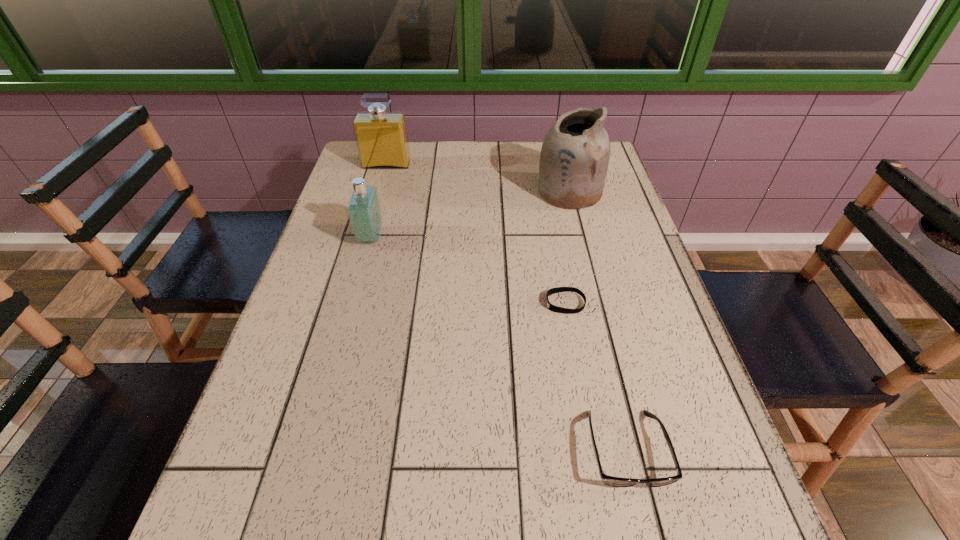
At what (x,y) coordinates should I click in order to perform the action: click on free space located on the front-facing side of the taller perfume. Please return your answer as a coordinate pair (x, y). The width and height of the screenshot is (960, 540). Looking at the image, I should click on (378, 193).

Identify the location of free location located on the front label of the third shortest object. This screenshot has height=540, width=960. tap(444, 237).

The image size is (960, 540). In order to click on vacant space located 0.060m on the display of the fourth farthest object in this screenshot , I will do `click(519, 303)`.

Locate an element on the screen. Image resolution: width=960 pixels, height=540 pixels. free region located 0.200m on the display of the fourth farthest object is located at coordinates (459, 303).

Locate an element on the screen. This screenshot has width=960, height=540. vacant space situated on the display of the fourth farthest object is located at coordinates (386, 303).

I want to click on pottery at the far edge, so click(x=574, y=158).

Find the location of a particular element. perfume located in the far edge section of the desktop is located at coordinates (381, 137).

Where is `pottery that is at the right edge`? pottery that is at the right edge is located at coordinates (574, 158).

At what (x,y) coordinates should I click in order to perform the action: click on spectacles at the right edge. Please return your answer as a coordinate pair (x, y). Looking at the image, I should click on (612, 481).

You are a GUI agent. You are given a task and a screenshot of the screen. Output one action in this format:
    pyautogui.click(x=<x>, y=<y>)
    Task: Click on the object that is at the far left corner
    
    Given the screenshot: What is the action you would take?
    pyautogui.click(x=381, y=137)